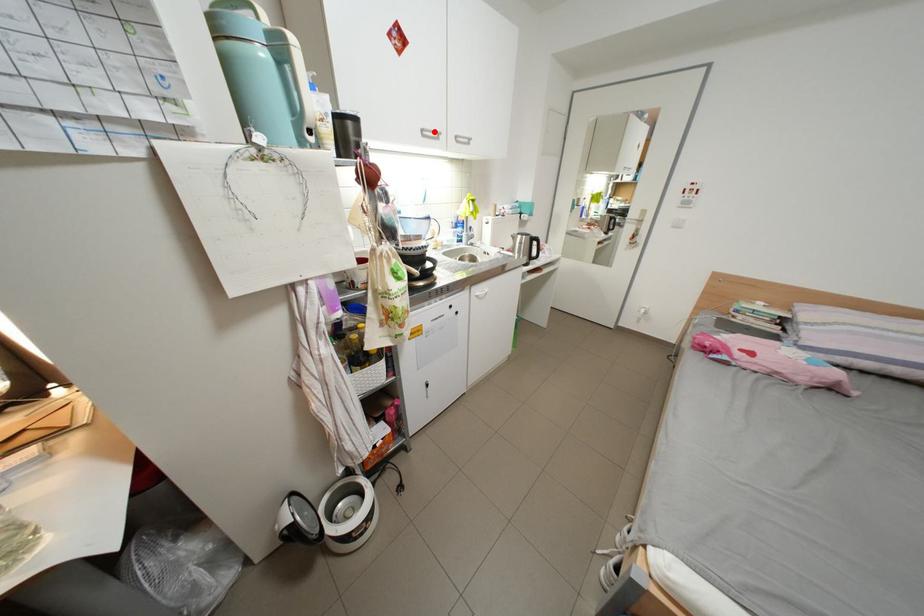
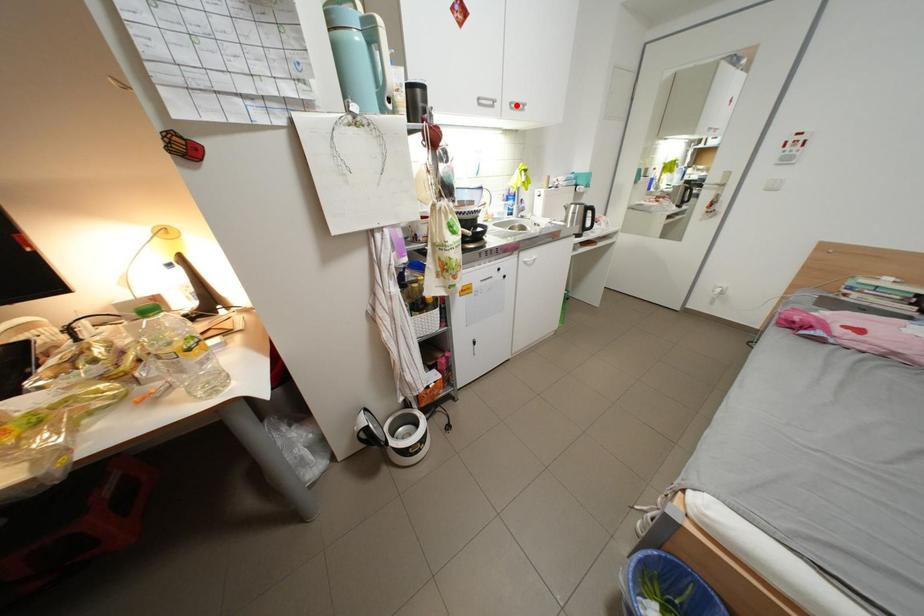
Consider the image. I am providing you with two images of the same scene from different viewpoints. A red point is marked on the first image and another point is marked on the second image. Is the red point in image1 aligned with the point shown in image2?

No